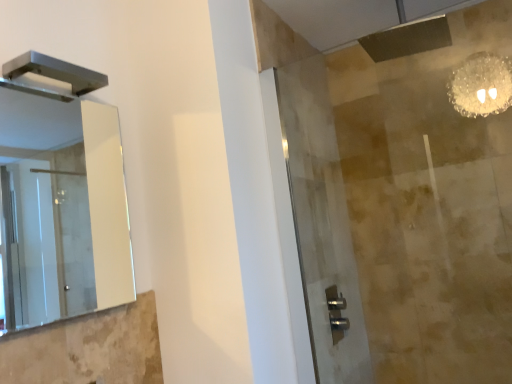
Question: Should I look upward or downward to see metallic rectangular fixture at upper left?

Choices:
 (A) down
 (B) up

Answer: (B)

Question: Is clear glass mirror at left looking in the opposite direction of metallic rectangular fixture at upper left?

Choices:
 (A) no
 (B) yes

Answer: (A)

Question: Is clear glass mirror at left outside of metallic rectangular fixture at upper left?

Choices:
 (A) yes
 (B) no

Answer: (A)

Question: Is metallic rectangular fixture at upper left inside clear glass mirror at left?

Choices:
 (A) yes
 (B) no

Answer: (B)

Question: Would you consider clear glass mirror at left to be distant from metallic rectangular fixture at upper left?

Choices:
 (A) no
 (B) yes

Answer: (B)

Question: Does clear glass mirror at left come behind metallic rectangular fixture at upper left?

Choices:
 (A) no
 (B) yes

Answer: (A)

Question: From the image's perspective, is clear glass mirror at left on metallic rectangular fixture at upper left?

Choices:
 (A) no
 (B) yes

Answer: (A)

Question: From a real-world perspective, is metallic rectangular fixture at upper left located beneath clear glass mirror at left?

Choices:
 (A) no
 (B) yes

Answer: (A)

Question: Are metallic rectangular fixture at upper left and clear glass mirror at left located far from each other?

Choices:
 (A) yes
 (B) no

Answer: (A)

Question: Is metallic rectangular fixture at upper left not inside clear glass mirror at left?

Choices:
 (A) no
 (B) yes

Answer: (B)

Question: Can you confirm if metallic rectangular fixture at upper left is wider than clear glass mirror at left?

Choices:
 (A) no
 (B) yes

Answer: (B)

Question: Does metallic rectangular fixture at upper left appear on the left side of clear glass mirror at left?

Choices:
 (A) no
 (B) yes

Answer: (B)

Question: Is the depth of metallic rectangular fixture at upper left less than that of clear glass mirror at left?

Choices:
 (A) no
 (B) yes

Answer: (A)

Question: From the image's perspective, is clear glass shower door at center beneath metallic rectangular fixture at upper left?

Choices:
 (A) no
 (B) yes

Answer: (B)